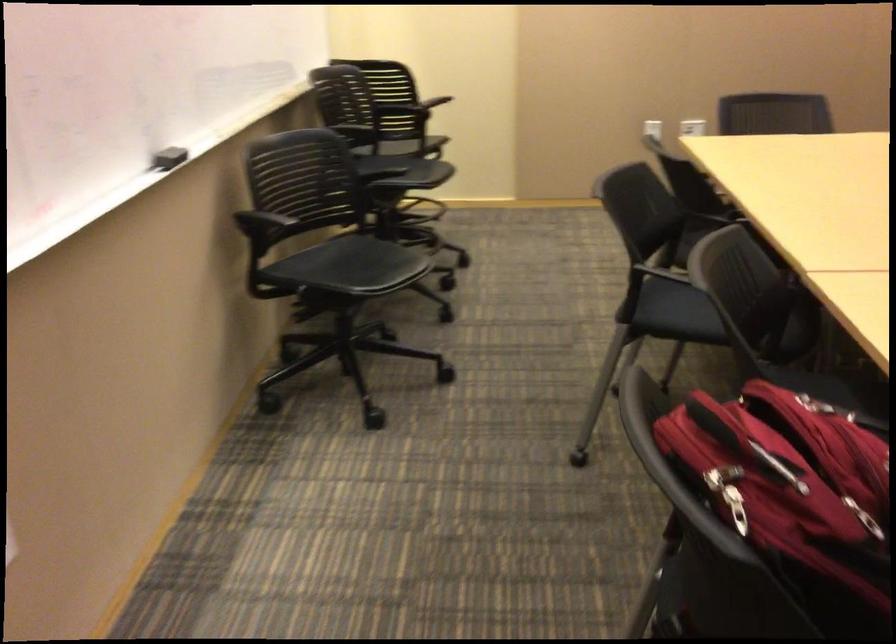
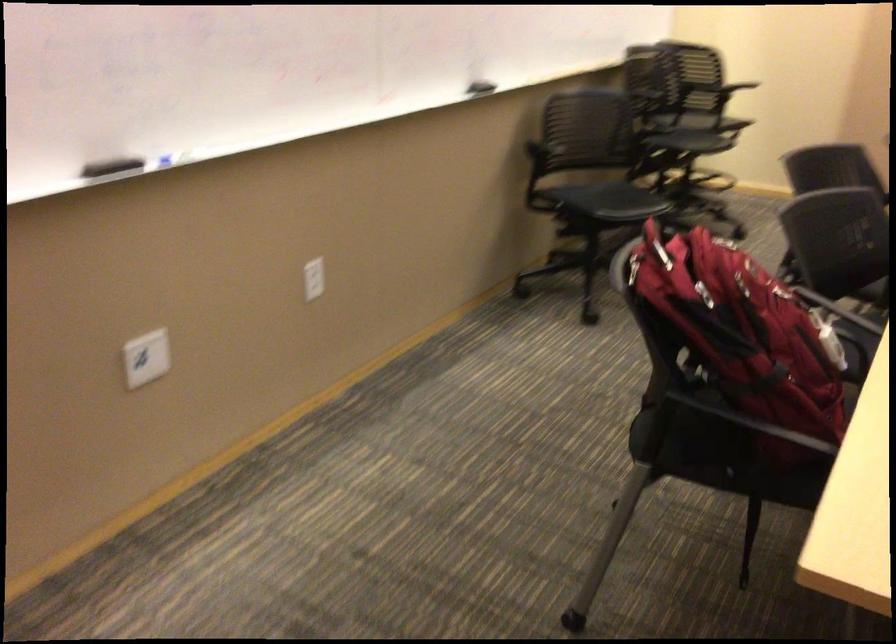
Which direction would the cameraman need to move to produce the second image?

The cameraman walked toward right, backward.